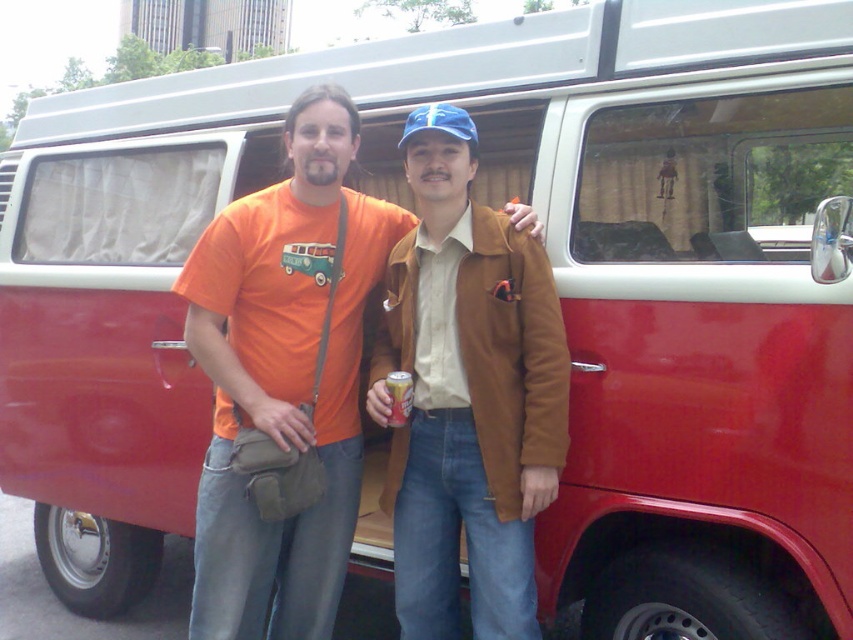
Question: Does orange cotton t-shirt at center have a larger size compared to orange aluminum can at center?

Choices:
 (A) no
 (B) yes

Answer: (B)

Question: Estimate the real-world distances between objects in this image. Which object is closer to the orange cotton t-shirt at center?

Choices:
 (A) brown leather jacket at center
 (B) orange aluminum can at center

Answer: (A)

Question: Which point appears closest to the camera in this image?

Choices:
 (A) (387, 385)
 (B) (502, 340)

Answer: (B)

Question: Can you confirm if orange cotton t-shirt at center is thinner than brown leather jacket at center?

Choices:
 (A) yes
 (B) no

Answer: (B)

Question: Considering the real-world distances, which object is closest to the orange aluminum can at center?

Choices:
 (A) brown leather jacket at center
 (B) orange cotton t-shirt at center

Answer: (A)

Question: Does brown leather jacket at center appear on the right side of orange aluminum can at center?

Choices:
 (A) yes
 (B) no

Answer: (A)